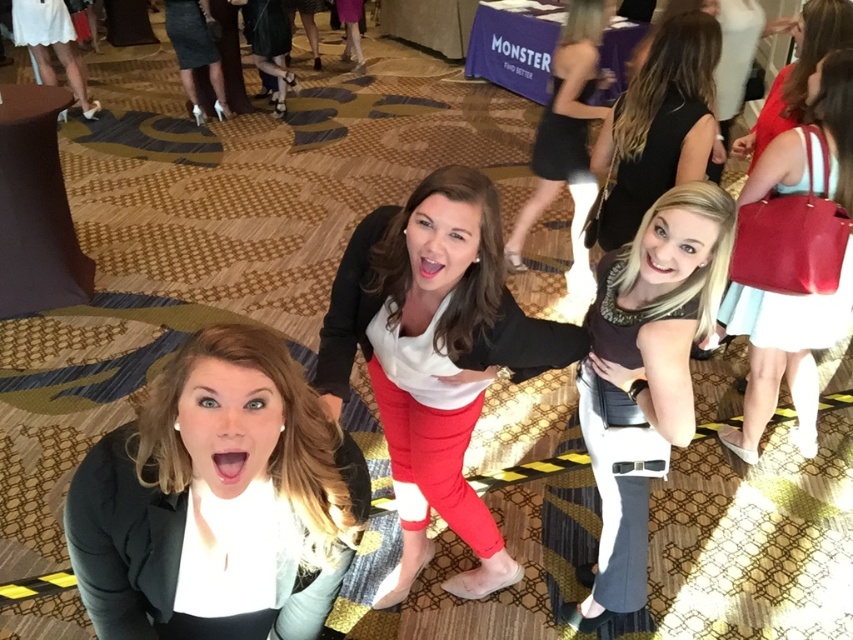
Question: Which object is the closest to the matte red handbag at right?

Choices:
 (A) matte black top at center
 (B) black leather dress at center
 (C) matte black purse at upper right
 (D) black matte blazer at lower left

Answer: (C)

Question: Is matte black top at center above black leather dress at upper right?

Choices:
 (A) no
 (B) yes

Answer: (A)

Question: Which of the following is the farthest from the observer?

Choices:
 (A) pos(751,156)
 (B) pos(112,529)

Answer: (A)

Question: Does white matte shirt at center come in front of matte black purse at upper right?

Choices:
 (A) no
 (B) yes

Answer: (B)

Question: Is black matte blazer at lower left further to the viewer compared to matte black purse at upper right?

Choices:
 (A) no
 (B) yes

Answer: (A)

Question: Which of the following is the farthest from the observer?

Choices:
 (A) black matte blazer at lower left
 (B) black leather dress at center
 (C) matte red handbag at right

Answer: (B)